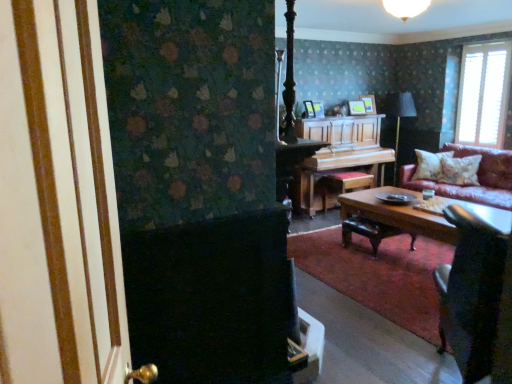
Question: From the image's perspective, is fluffy white pillow at right, the 1th pillow positioned from the front, positioned above or below wooden polished coffee table at center?

Choices:
 (A) below
 (B) above

Answer: (B)

Question: Is fluffy white pillow at right, the 1th pillow positioned from the front, wider or thinner than wooden polished coffee table at center?

Choices:
 (A) wide
 (B) thin

Answer: (B)

Question: Which object is positioned closest to the fluffy white pillow at right, the 1th pillow positioned from the front?

Choices:
 (A) black matte screen door at left
 (B) white textured pillow at right, the first pillow in the back-to-front sequence
 (C) white glass lampshade at upper center
 (D) wooden stool at center
 (E) velvet dark brown armchair at lower right

Answer: (B)

Question: Estimate the real-world distances between objects in this image. Which object is farther from the velvet dark brown armchair at lower right?

Choices:
 (A) white textured blinds at upper right
 (B) fluffy white pillow at right, which appears as the 2th pillow when viewed from the back
 (C) wooden stool at center
 (D) metallic gold table lamp at upper center
 (E) black matte screen door at left

Answer: (D)